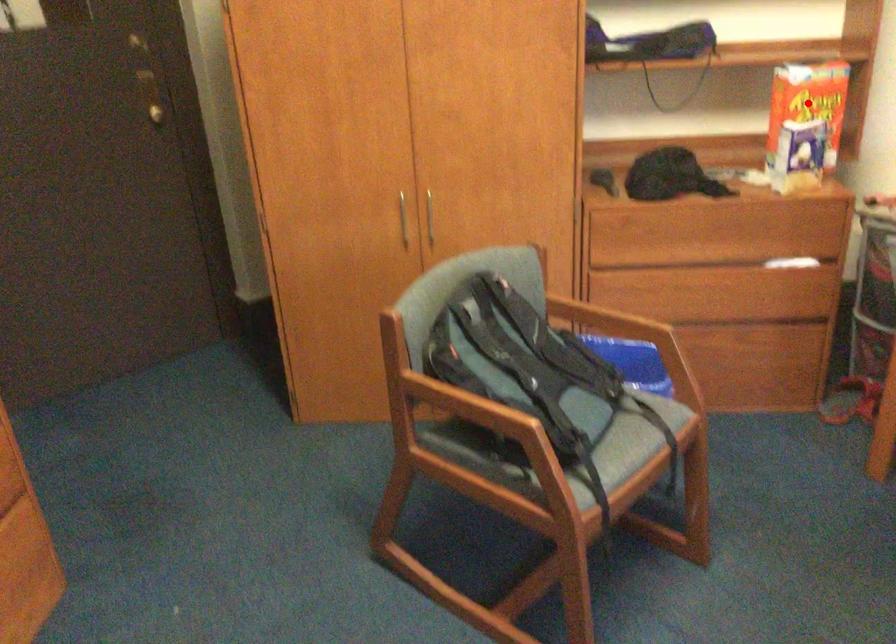
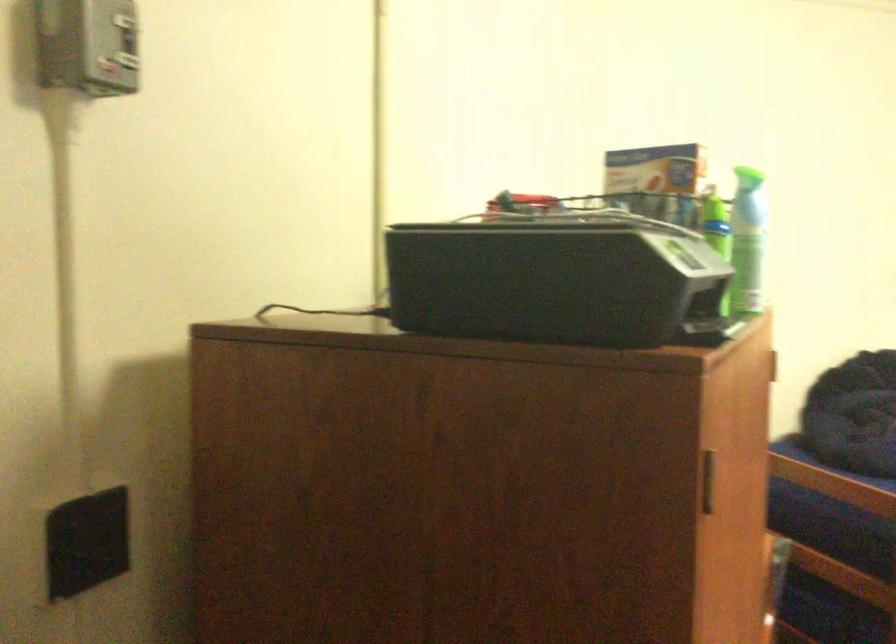
Question: I am providing you with two images of the same scene from different viewpoints. A red point is marked on the first image. At the location where the point appears in image 1, is it still visible in image 2?

Choices:
 (A) Yes
 (B) No

Answer: (B)